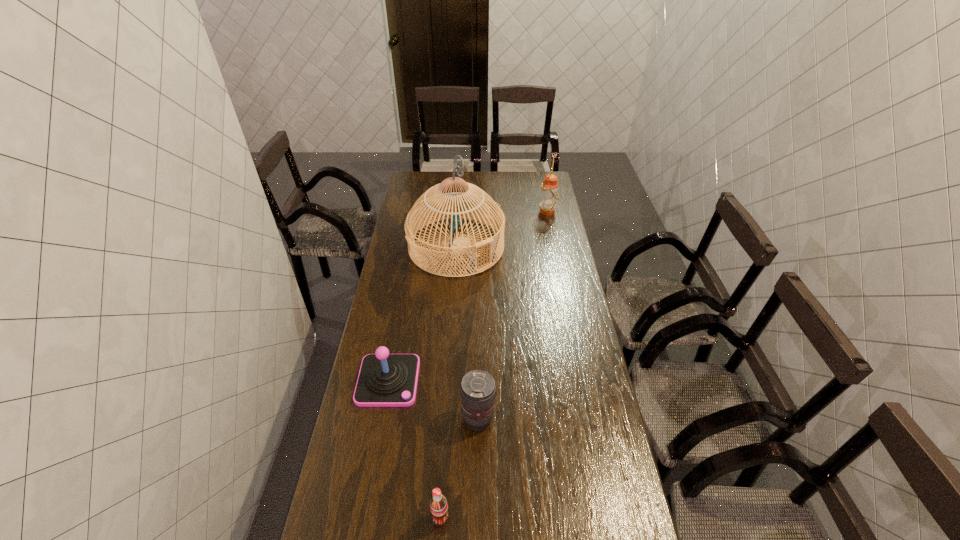
Where is `blank space located 0.290m forward from the base of the joystick`? The width and height of the screenshot is (960, 540). blank space located 0.290m forward from the base of the joystick is located at coordinates (366, 503).

Image resolution: width=960 pixels, height=540 pixels. I want to click on free space located 0.280m on the right of the soda, so click(557, 517).

The image size is (960, 540). Identify the location of birdcage that is at the left edge. (461, 201).

The width and height of the screenshot is (960, 540). In order to click on joystick at the left edge in this screenshot , I will do `click(385, 380)`.

You are a GUI agent. You are given a task and a screenshot of the screen. Output one action in this format:
    pyautogui.click(x=<x>, y=<y>)
    Task: Click on the object present at the right edge
    The image size is (960, 540).
    Given the screenshot: What is the action you would take?
    pyautogui.click(x=549, y=194)

The width and height of the screenshot is (960, 540). I want to click on blank area at the far edge, so click(x=490, y=176).

You are a GUI agent. You are given a task and a screenshot of the screen. Output one action in this format:
    pyautogui.click(x=<x>, y=<y>)
    Task: Click on the free space at the left edge of the desktop
    
    Given the screenshot: What is the action you would take?
    pyautogui.click(x=396, y=300)

In the image, there is a desktop. In order to click on vacant space at the right edge in this screenshot , I will do `click(546, 306)`.

Image resolution: width=960 pixels, height=540 pixels. Identify the location of empty space that is in between the telephoto lens and the soda. (459, 468).

At what (x,y) coordinates should I click in order to perform the action: click on vacant space that is in between the joystick and the tallest object. Please return your answer as a coordinate pair (x, y). This screenshot has height=540, width=960. Looking at the image, I should click on (422, 314).